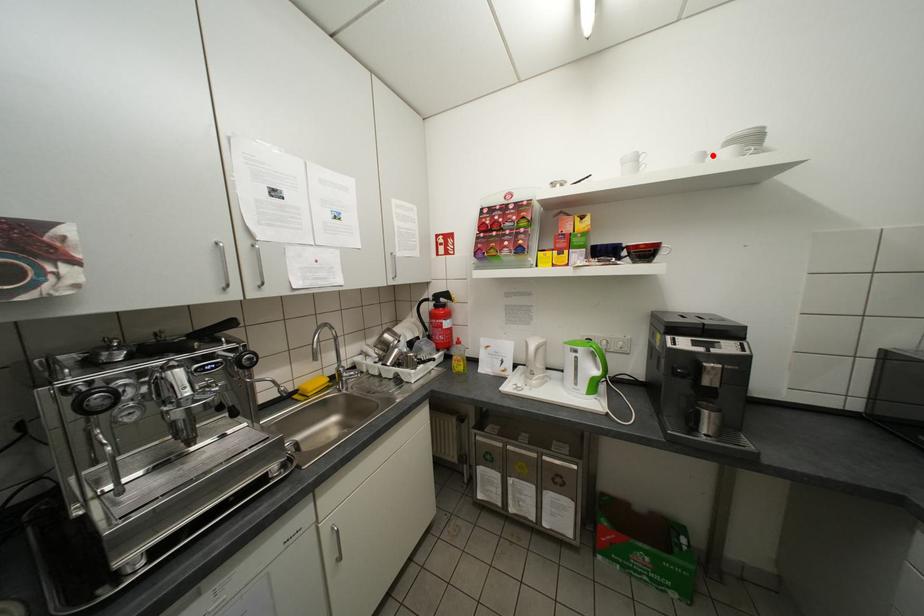
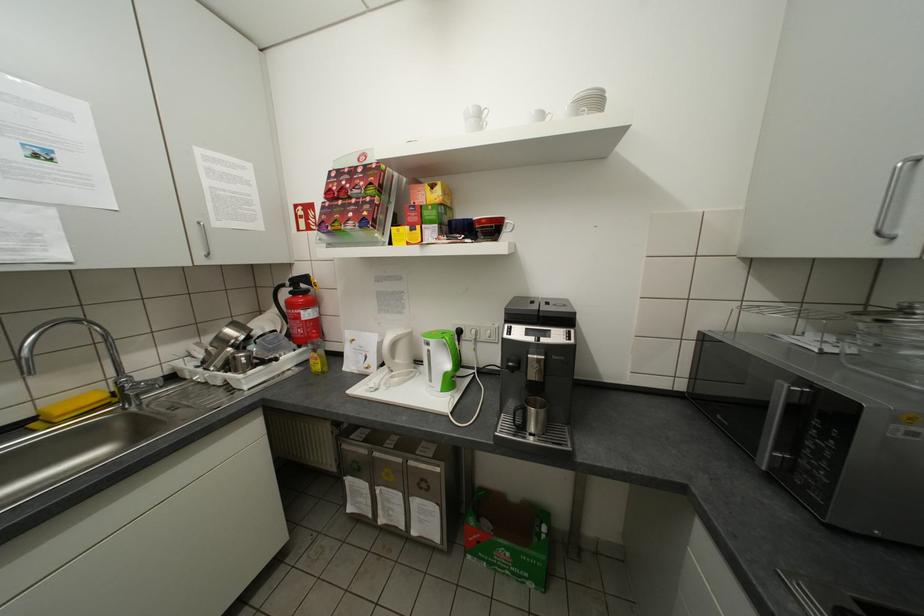
In the second image, find the point that corresponds to the highlighted location in the first image.

(551, 116)